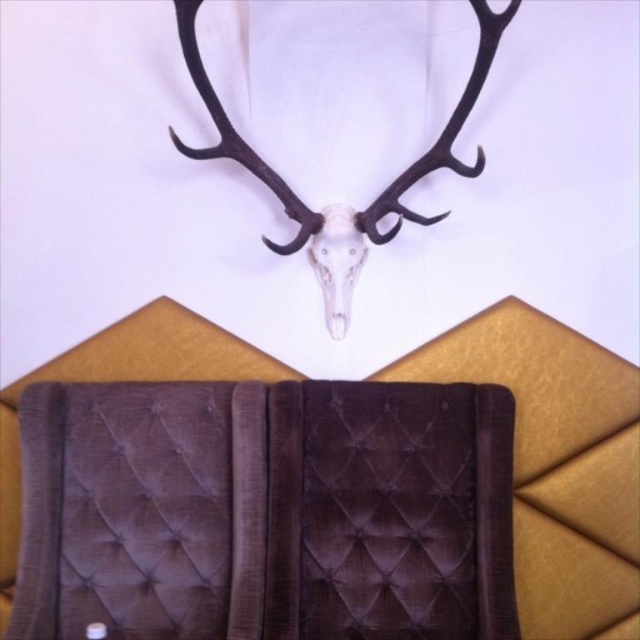
You are an interior designer assessing the balance of a room. You notice the black matte antler at upper center and the white matte skull at center. Which object is positioned higher up in the composition?

The black matte antler at upper center is positioned higher up in the composition than the white matte skull at center because it is much taller as described.

You are standing in a room with a mounted deer skull above a mustard yellow geometric patterned sofa. There are two points marked in the image, point A at coordinates point (x=294, y=212) and point B at coordinates point (x=362, y=260). Which point is closer to you?

Point point (x=294, y=212) is closer to the viewer than point point (x=362, y=260).

You are an interior designer planning to hang a decorative item between the black matte antler at upper center and the white matte skull at center. The item you want to hang is 5 inches wide. Is there enough space between them to fit this item?

The distance between the black matte antler at upper center and the white matte skull at center is 6.43 inches. Since the decorative item is 5 inches wide, there is enough space to fit it between them.